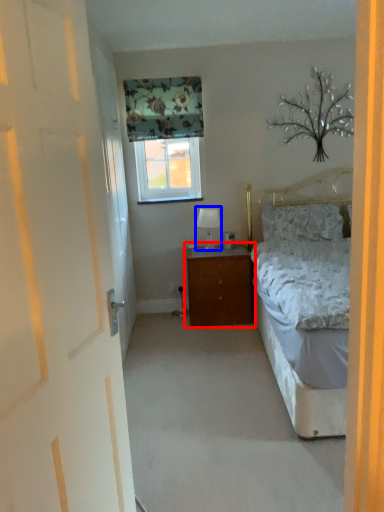
Question: Among these objects, which one is nearest to the camera, nightstand (highlighted by a red box) or table lamp (highlighted by a blue box)?

Choices:
 (A) nightstand
 (B) table lamp

Answer: (A)